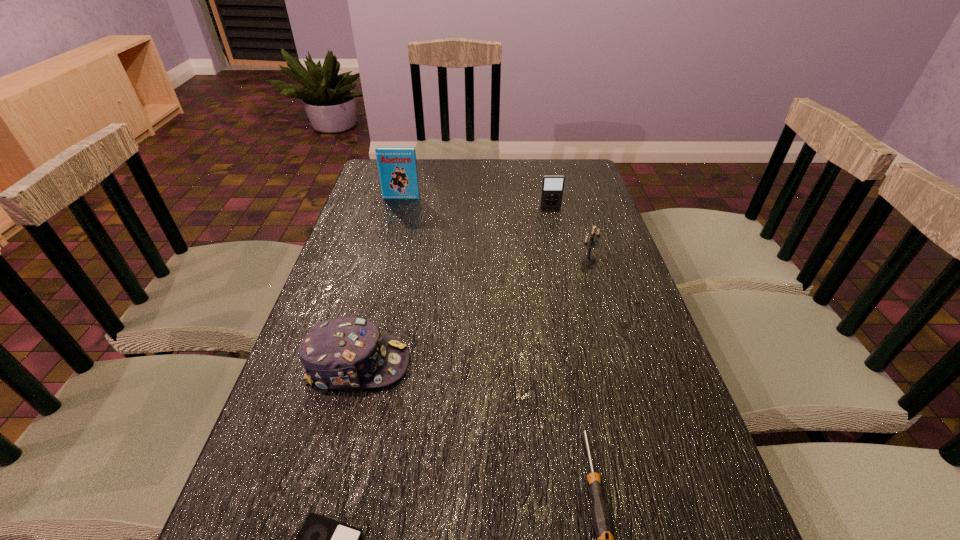
Locate an element on the screen. The width and height of the screenshot is (960, 540). unoccupied position between the book and the third nearest object is located at coordinates (379, 281).

What are the coordinates of `free spot between the tallest object and the third nearest object` in the screenshot? It's located at (379, 281).

Locate an element on the screen. free area in between the fourth farthest object and the rightmost object is located at coordinates (473, 312).

Locate an element on the screen. Image resolution: width=960 pixels, height=540 pixels. unoccupied area between the third nearest object and the farthest object is located at coordinates (379, 281).

Locate an element on the screen. The width and height of the screenshot is (960, 540). free space between the third farthest object and the headwear is located at coordinates 473,312.

Where is `empty space between the rightmost object and the book`? The width and height of the screenshot is (960, 540). empty space between the rightmost object and the book is located at coordinates (494, 229).

Identify which object is located as the second nearest to the farthest object. Please provide its 2D coordinates. Your answer should be formatted as a tuple, i.e. [(x, y)], where the tuple contains the x and y coordinates of a point satisfying the conditions above.

[(591, 243)]

The image size is (960, 540). Find the location of `object that stands as the fifth closest to the book`. object that stands as the fifth closest to the book is located at coordinates (321, 539).

Where is `free space that satisfies the following two spatial constraints: 1. on the front-facing side of the candle holder; 2. on the right side of the right iPod`? The image size is (960, 540). free space that satisfies the following two spatial constraints: 1. on the front-facing side of the candle holder; 2. on the right side of the right iPod is located at coordinates (563, 260).

Find the location of a particular element. Image resolution: width=960 pixels, height=540 pixels. vacant space that satisfies the following two spatial constraints: 1. on the front cover of the tallest object; 2. on the front-facing side of the fourth farthest object is located at coordinates tap(359, 364).